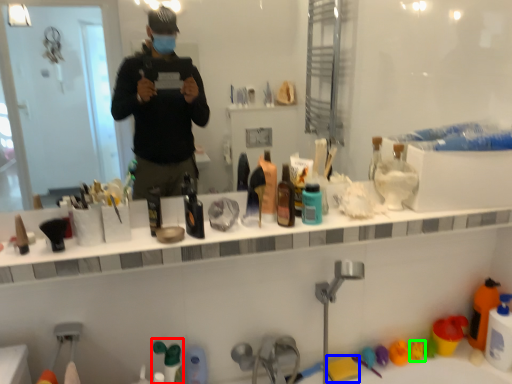
Question: Considering the real-world distances, which object is closest to toiletry (highlighted by a red box)? toy (highlighted by a blue box) or toy (highlighted by a green box).

Choices:
 (A) toy
 (B) toy

Answer: (A)